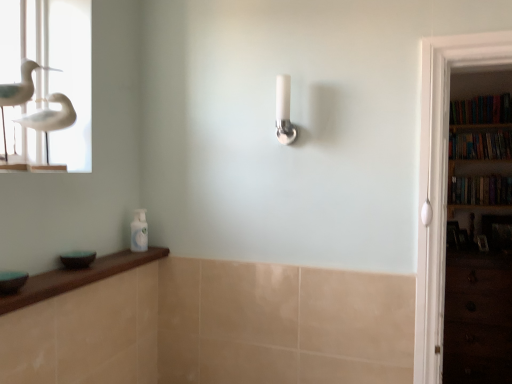
Question: Is hardcover books at right, the second book from the top, not close to hardcover books at right, the 3th book ordered from the bottom?

Choices:
 (A) yes
 (B) no

Answer: (B)

Question: Is hardcover books at right, the second book from the top, further to camera compared to hardcover books at right, the 3th book ordered from the bottom?

Choices:
 (A) no
 (B) yes

Answer: (A)

Question: Considering the relative positions of hardcover books at right, the second book from the top, and hardcover books at right, the 3th book ordered from the bottom, in the image provided, is hardcover books at right, the second book from the top, to the left of hardcover books at right, the 3th book ordered from the bottom, from the viewer's perspective?

Choices:
 (A) no
 (B) yes

Answer: (A)

Question: Is hardcover books at right, the second book from the top, smaller than hardcover books at right, marked as the 1th book in a top-to-bottom arrangement?

Choices:
 (A) yes
 (B) no

Answer: (B)

Question: Does hardcover books at right, the second book from the top, touch hardcover books at right, marked as the 1th book in a top-to-bottom arrangement?

Choices:
 (A) no
 (B) yes

Answer: (A)

Question: Considering the positions of point (480, 359) and point (484, 152), is point (480, 359) closer or farther from the camera than point (484, 152)?

Choices:
 (A) farther
 (B) closer

Answer: (B)

Question: Relative to hardcover books at right, which appears as the second book when ordered from the bottom, is dark wood drawer at lower right in front or behind?

Choices:
 (A) front
 (B) behind

Answer: (A)

Question: Which is correct: dark wood drawer at lower right is inside hardcover books at right, which appears as the second book when ordered from the bottom, or outside of it?

Choices:
 (A) outside
 (B) inside

Answer: (A)

Question: Is dark wood drawer at lower right taller or shorter than hardcover books at right, the second book from the top?

Choices:
 (A) short
 (B) tall

Answer: (B)

Question: Is point (281, 82) closer or farther from the camera than point (504, 329)?

Choices:
 (A) closer
 (B) farther

Answer: (A)

Question: From the image's perspective, is white glossy shower head at center positioned above or below dark wood drawer at lower right?

Choices:
 (A) below
 (B) above

Answer: (B)

Question: From a real-world perspective, relative to dark wood drawer at lower right, is white glossy shower head at center vertically above or below?

Choices:
 (A) below
 (B) above

Answer: (B)

Question: Would you say white glossy shower head at center is to the left or to the right of dark wood drawer at lower right in the picture?

Choices:
 (A) left
 (B) right

Answer: (A)

Question: From a real-world perspective, is white glossy shower head at center physically located above or below hardcover books at right, the 3th book ordered from the bottom?

Choices:
 (A) below
 (B) above

Answer: (A)

Question: From the image's perspective, is white glossy shower head at center located above or below hardcover books at right, the 3th book ordered from the bottom?

Choices:
 (A) above
 (B) below

Answer: (B)